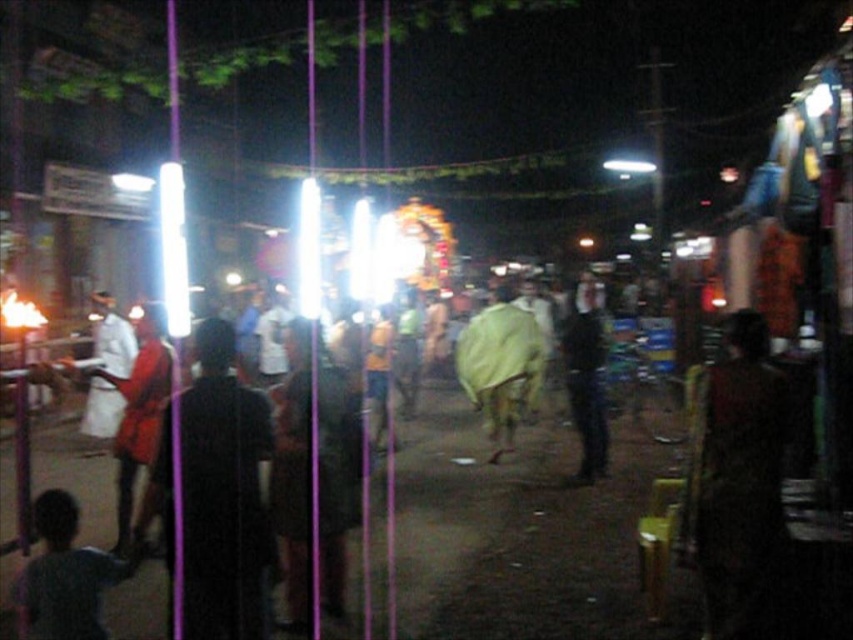
Question: Which object is closer to the camera taking this photo?

Choices:
 (A) red fabric cloth at left
 (B) yellow fabric at center
 (C) dark gray shirt at lower left
 (D) black matte jacket at center

Answer: (C)

Question: Which of the following is the closest to the observer?

Choices:
 (A) (171, 412)
 (B) (741, 413)

Answer: (A)

Question: Does yellow fabric at center have a greater width compared to red fabric cloth at left?

Choices:
 (A) yes
 (B) no

Answer: (A)

Question: Does dark brown textured shirt at center have a lesser width compared to dark gray shirt at lower left?

Choices:
 (A) no
 (B) yes

Answer: (B)

Question: Does dark fabric pants at center appear on the left side of black matte jacket at center?

Choices:
 (A) no
 (B) yes

Answer: (B)

Question: Which point is closer to the camera?

Choices:
 (A) (22, 576)
 (B) (535, 333)

Answer: (A)